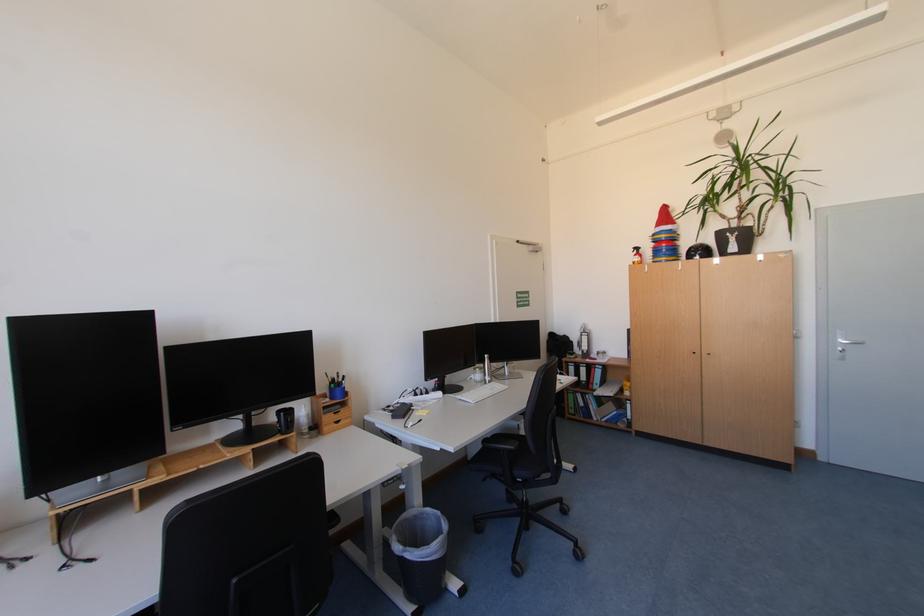
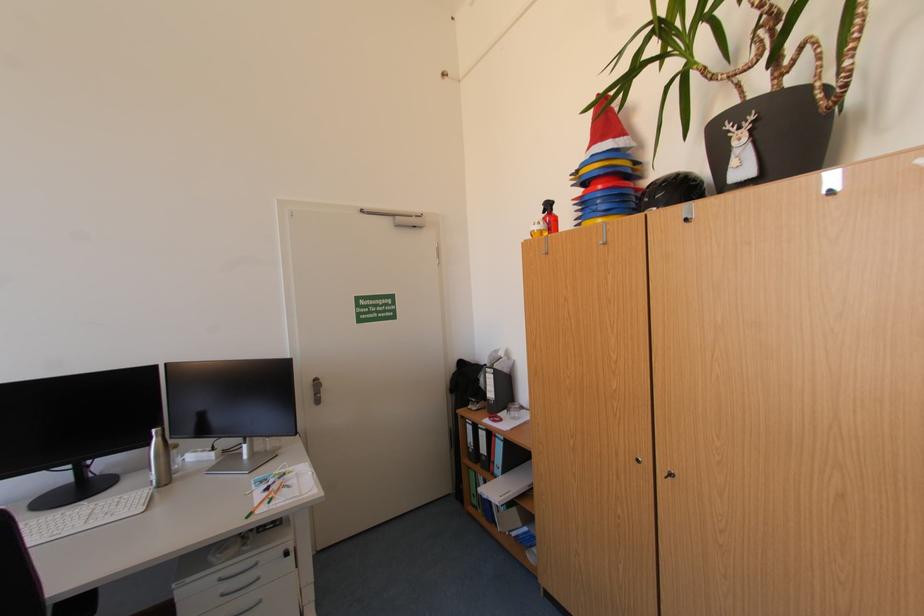
Where in the second image is the point corresponding to point (640, 253) from the first image?

(552, 213)